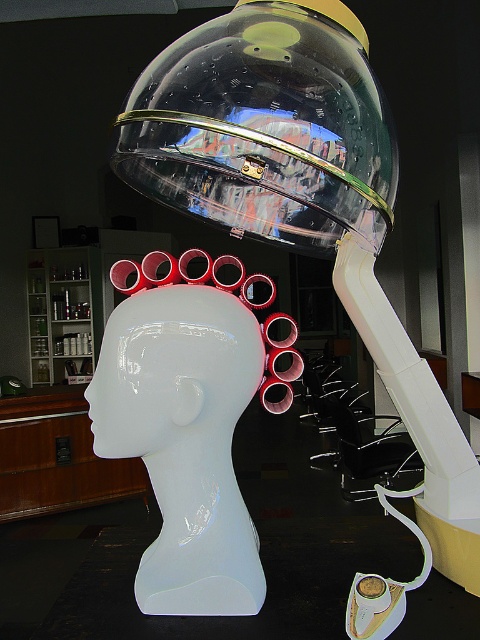
You are a stylist trying to adjust the position of the transparent plastic dome at upper center so it can cover the glossy white head at center properly. Based on their current positions, is the dome already positioned correctly to cover the head?

The transparent plastic dome at upper center is located above the glossy white head at center, so it is positioned correctly to cover the head as it is directly above it.

You are standing in front of the mannequin head in the salon. There are two points marked on the image. Which point, point (236, 65) or point (240, 371), is closer to you?

Point (236, 65) is closer to the viewer than point (240, 371).